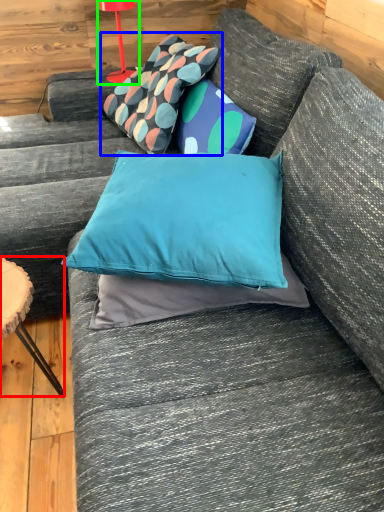
Question: Which is nearer to the furniture (highlighted by a red box)? pillow (highlighted by a blue box) or table lamp (highlighted by a green box).

Choices:
 (A) pillow
 (B) table lamp

Answer: (A)